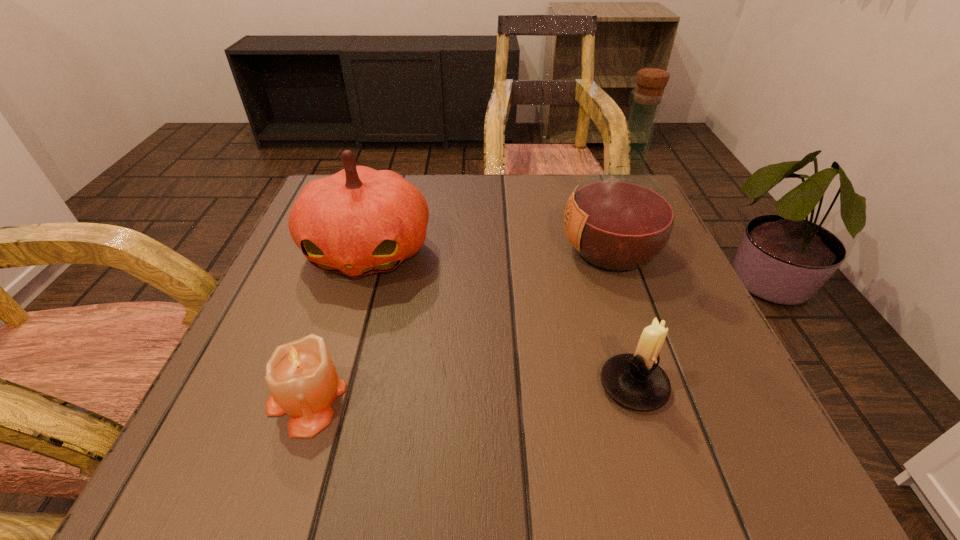
Where is `vacant space that satisfies the following two spatial constraints: 1. on the front-facing side of the second shortest object; 2. on the right side of the third shortest object`? The image size is (960, 540). vacant space that satisfies the following two spatial constraints: 1. on the front-facing side of the second shortest object; 2. on the right side of the third shortest object is located at coordinates click(x=326, y=386).